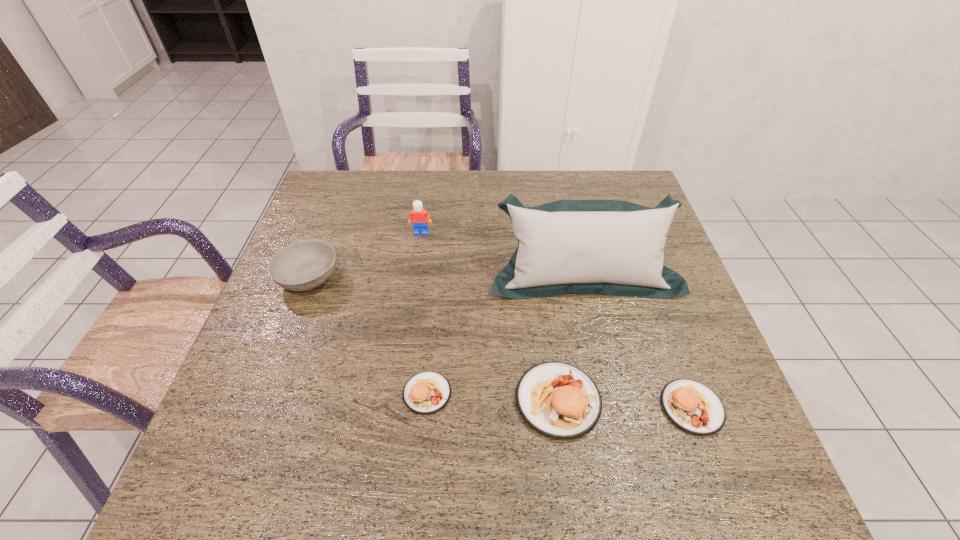
Find the location of a particular element. This screenshot has height=540, width=960. vacant space that satisfies the following two spatial constraints: 1. on the face of the second shortest patty; 2. on the right side of the farthest object is located at coordinates (396, 407).